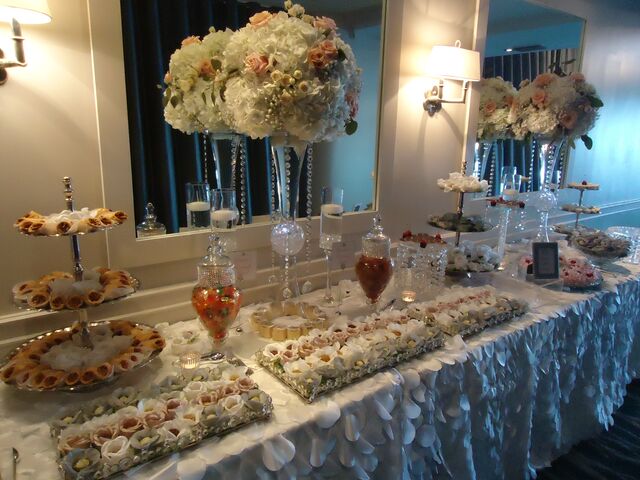
At what (x,y) coordinates should I click in order to perform the action: click on wall lights. Please return your answer as a coordinate pair (x, y). Looking at the image, I should click on (40, 11), (468, 70).